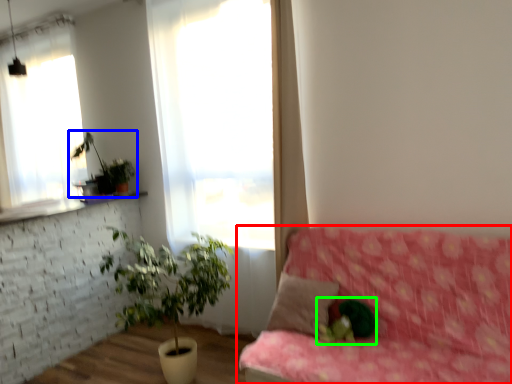
Question: Considering the real-world distances, which object is closest to studio couch (highlighted by a red box)? houseplant (highlighted by a blue box) or plant (highlighted by a green box).

Choices:
 (A) houseplant
 (B) plant

Answer: (B)